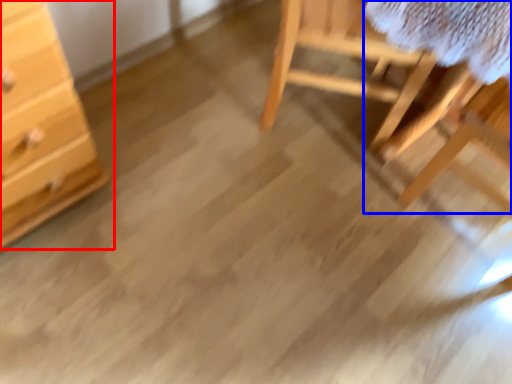
Question: Which point is closer to the camera, chest of drawers (highlighted by a red box) or table (highlighted by a blue box)?

Choices:
 (A) chest of drawers
 (B) table

Answer: (A)